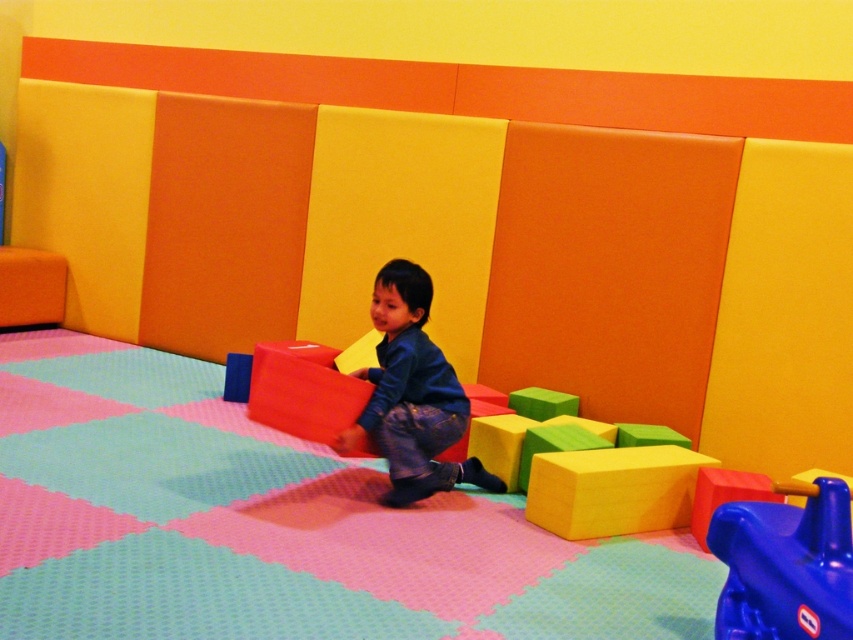
Is dark blue denim pants at center thinner than yellow foam cube at center?

Yes.

Is point (412, 301) positioned after point (650, 499)?

No, (412, 301) is in front of (650, 499).

Image resolution: width=853 pixels, height=640 pixels. I want to click on dark blue denim pants at center, so click(x=412, y=394).

Image resolution: width=853 pixels, height=640 pixels. Describe the element at coordinates (785, 564) in the screenshot. I see `blue plastic toy at lower right` at that location.

You are a GUI agent. You are given a task and a screenshot of the screen. Output one action in this format:
    pyautogui.click(x=<x>, y=<y>)
    Task: Click on the blue plastic toy at lower right
    
    Given the screenshot: What is the action you would take?
    pyautogui.click(x=785, y=564)

Which is in front, point (787, 579) or point (637, 499)?

Positioned in front is point (787, 579).

The width and height of the screenshot is (853, 640). What are the coordinates of `blue plastic toy at lower right` in the screenshot? It's located at point(785,564).

Can you confirm if blue plastic toy at lower right is shorter than dark blue denim pants at center?

Yes.

Is blue plastic toy at lower right above dark blue denim pants at center?

No, blue plastic toy at lower right is not above dark blue denim pants at center.

Between point (782, 582) and point (419, 304), which one is positioned in front?

Point (782, 582) is more forward.

Where is `blue plastic toy at lower right`? The height and width of the screenshot is (640, 853). blue plastic toy at lower right is located at coordinates (785, 564).